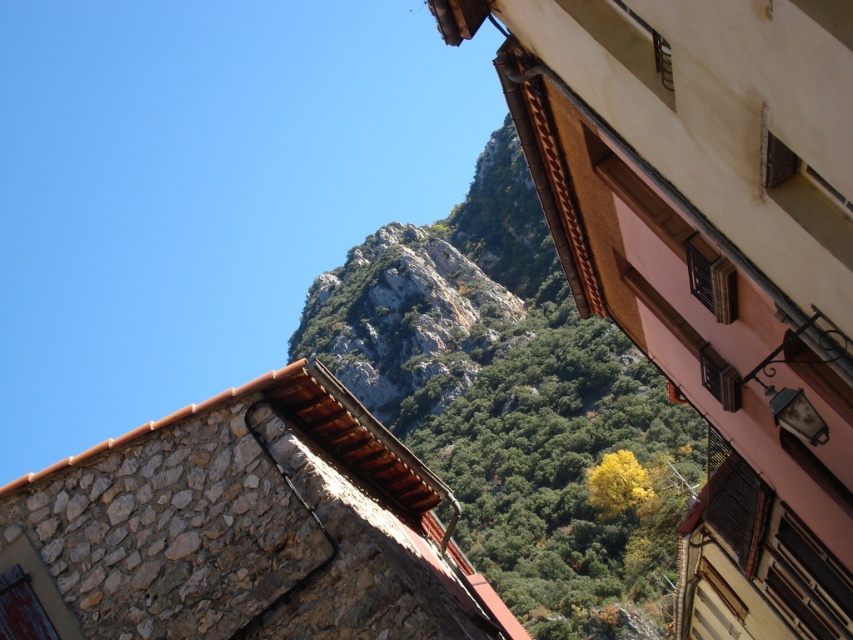
Which is behind, point (540, 321) or point (372, 531)?

The point (540, 321) is behind.

Is rockymaterial/texturemountain at center above rustic stone wall at center?

Correct, rockymaterial/texturemountain at center is located above rustic stone wall at center.

The width and height of the screenshot is (853, 640). Describe the element at coordinates (512, 401) in the screenshot. I see `rockymaterial/texturemountain at center` at that location.

The image size is (853, 640). In order to click on rockymaterial/texturemountain at center in this screenshot , I will do `click(512, 401)`.